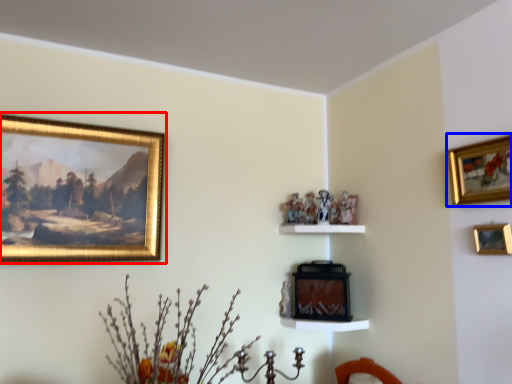
Question: Which object is further to the camera taking this photo, picture frame (highlighted by a red box) or picture frame (highlighted by a blue box)?

Choices:
 (A) picture frame
 (B) picture frame

Answer: (A)